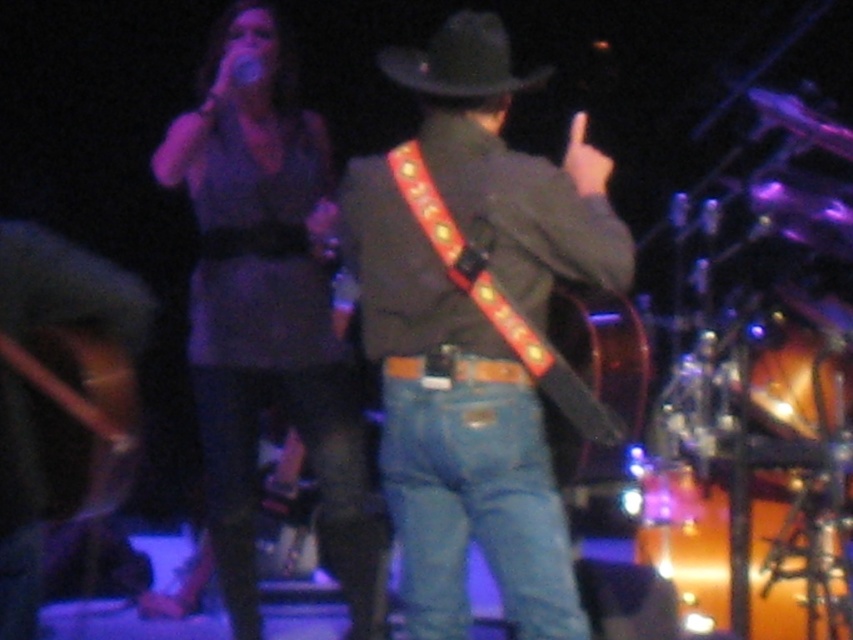
Question: Is blue denim jeans at center wider than metallic silver microphone at upper center?

Choices:
 (A) yes
 (B) no

Answer: (A)

Question: Estimate the real-world distances between objects in this image. Which object is farther from the matte purple dress at upper left?

Choices:
 (A) blue denim jeans at center
 (B) matte brown guitar at center
 (C) metallic silver microphone at upper center

Answer: (B)

Question: Which of the following is the closest to the observer?

Choices:
 (A) matte purple dress at upper left
 (B) black felt hat at upper center

Answer: (B)

Question: Can you confirm if matte purple dress at upper left is positioned to the left of blue denim jeans at center?

Choices:
 (A) no
 (B) yes

Answer: (B)

Question: Is matte purple dress at upper left smaller than matte brown guitar at center?

Choices:
 (A) no
 (B) yes

Answer: (A)

Question: Among these objects, which one is farthest from the camera?

Choices:
 (A) blue denim jeans at center
 (B) matte brown guitar at center

Answer: (A)